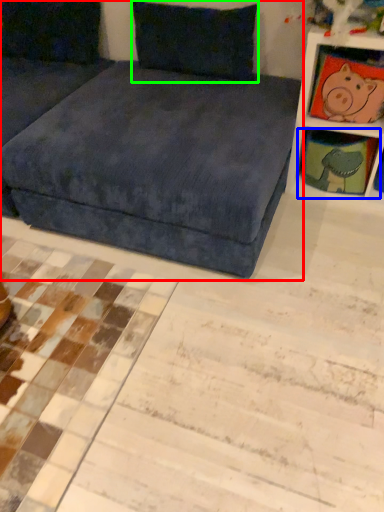
Question: Which is farther away from studio couch (highlighted by a red box)? shelf (highlighted by a blue box) or pillow (highlighted by a green box)?

Choices:
 (A) shelf
 (B) pillow

Answer: (A)